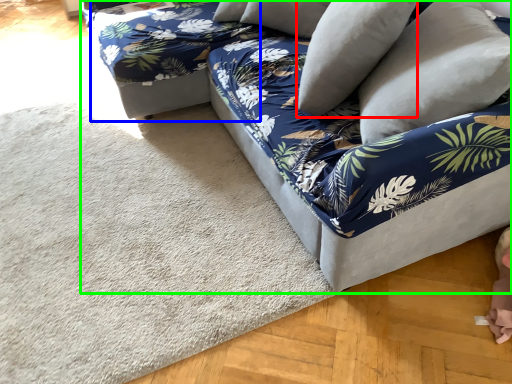
Question: Estimate the real-world distances between objects in this image. Which object is farther from pillow (highlighted by a red box), bean bag chair (highlighted by a blue box) or studio couch (highlighted by a green box)?

Choices:
 (A) bean bag chair
 (B) studio couch

Answer: (A)